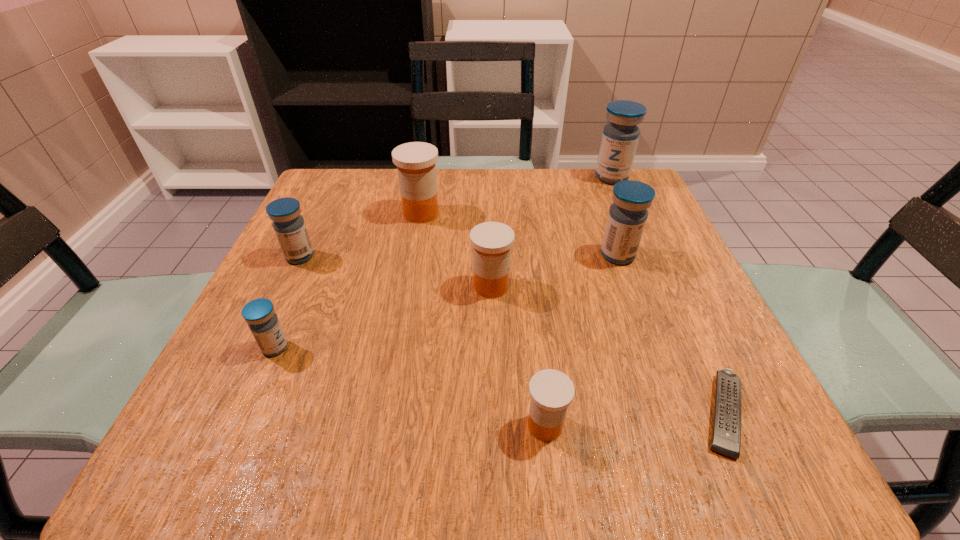
This screenshot has width=960, height=540. I want to click on free space between the leftmost orange medicine and the second farthest orange medicine, so click(x=456, y=250).

Where is `unoccupied area between the remote control and the fourth object from right to left`? The image size is (960, 540). unoccupied area between the remote control and the fourth object from right to left is located at coordinates (635, 419).

Identify the location of free space between the leftmost orange medicine and the sixth farthest object. (348, 280).

Locate an element on the screen. This screenshot has height=540, width=960. free area in between the shortest object and the smallest orange medicine is located at coordinates (635, 419).

This screenshot has height=540, width=960. In order to click on vacant point located between the third biggest blue medicine and the smallest orange medicine in this screenshot , I will do `click(422, 341)`.

I want to click on the fourth closest object to the second biggest blue medicine, so click(551, 391).

The width and height of the screenshot is (960, 540). Find the location of `object that stands as the second closest to the nearest blue medicine`. object that stands as the second closest to the nearest blue medicine is located at coordinates (492, 241).

Identify which medicine is located as the nearest to the third medicine from left to right. Please provide its 2D coordinates. Your answer should be formatted as a tuple, i.e. [(x, y)], where the tuple contains the x and y coordinates of a point satisfying the conditions above.

[(289, 226)]

The width and height of the screenshot is (960, 540). I want to click on medicine that stands as the closest to the farthest blue medicine, so click(x=627, y=216).

Select which blue medicine appears as the closest to the remote control. Please provide its 2D coordinates. Your answer should be formatted as a tuple, i.e. [(x, y)], where the tuple contains the x and y coordinates of a point satisfying the conditions above.

[(627, 216)]